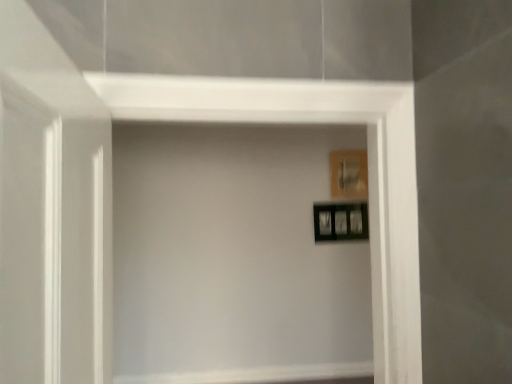
Question: Is black glossy picture frame at upper right, which appears as the 1th picture frame when ordered from the bottom, positioned beyond the bounds of wooden picture frame at upper right, the 2th picture frame positioned from the bottom?

Choices:
 (A) no
 (B) yes

Answer: (B)

Question: From the image's perspective, does black glossy picture frame at upper right, the 2th picture frame from the top, appear lower than wooden picture frame at upper right, which is the 1th picture frame in top-to-bottom order?

Choices:
 (A) yes
 (B) no

Answer: (A)

Question: Is black glossy picture frame at upper right, the 2th picture frame from the top, oriented towards wooden picture frame at upper right, which is the 1th picture frame in top-to-bottom order?

Choices:
 (A) no
 (B) yes

Answer: (A)

Question: Is black glossy picture frame at upper right, which appears as the 1th picture frame when ordered from the bottom, facing away from wooden picture frame at upper right, which is the 1th picture frame in top-to-bottom order?

Choices:
 (A) yes
 (B) no

Answer: (B)

Question: Is black glossy picture frame at upper right, the 2th picture frame from the top, closer to camera compared to wooden picture frame at upper right, the 2th picture frame positioned from the bottom?

Choices:
 (A) yes
 (B) no

Answer: (A)

Question: Is black glossy picture frame at upper right, which appears as the 1th picture frame when ordered from the bottom, far from wooden picture frame at upper right, the 2th picture frame positioned from the bottom?

Choices:
 (A) no
 (B) yes

Answer: (A)

Question: Does black glossy picture frame at upper right, which appears as the 1th picture frame when ordered from the bottom, appear on the right side of transparent glass door at left?

Choices:
 (A) yes
 (B) no

Answer: (A)

Question: From the image's perspective, is black glossy picture frame at upper right, the 2th picture frame from the top, on transparent glass door at left?

Choices:
 (A) no
 (B) yes

Answer: (A)

Question: Is transparent glass door at left completely or partially inside black glossy picture frame at upper right, the 2th picture frame from the top?

Choices:
 (A) yes
 (B) no

Answer: (B)

Question: Is black glossy picture frame at upper right, the 2th picture frame from the top, smaller than transparent glass door at left?

Choices:
 (A) no
 (B) yes

Answer: (B)

Question: Does black glossy picture frame at upper right, which appears as the 1th picture frame when ordered from the bottom, lie in front of transparent glass door at left?

Choices:
 (A) yes
 (B) no

Answer: (B)

Question: Considering the relative sizes of black glossy picture frame at upper right, which appears as the 1th picture frame when ordered from the bottom, and transparent glass door at left in the image provided, is black glossy picture frame at upper right, which appears as the 1th picture frame when ordered from the bottom, bigger than transparent glass door at left?

Choices:
 (A) yes
 (B) no

Answer: (B)

Question: Considering the relative positions of transparent glass door at left and wooden picture frame at upper right, the 2th picture frame positioned from the bottom, in the image provided, is transparent glass door at left to the left of wooden picture frame at upper right, the 2th picture frame positioned from the bottom, from the viewer's perspective?

Choices:
 (A) yes
 (B) no

Answer: (A)